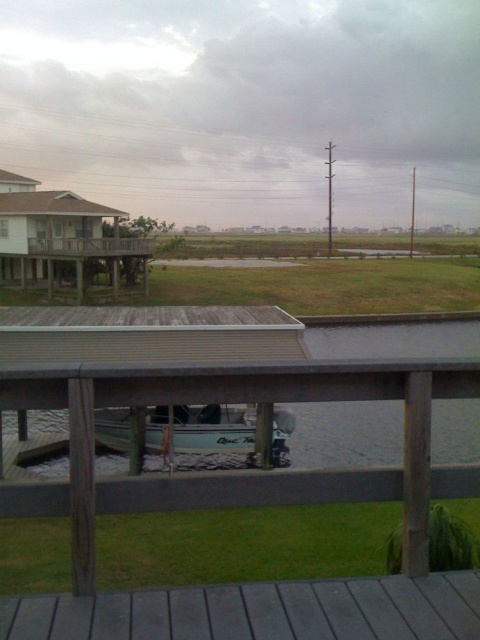
Question: Is dark gray wood deck at lower center below light blue fiberglass boat at center?

Choices:
 (A) no
 (B) yes

Answer: (A)

Question: Which object is farther from the camera taking this photo?

Choices:
 (A) dark gray wood deck at lower center
 (B) light blue fiberglass boat at center

Answer: (B)

Question: Does dark gray wood deck at lower center have a smaller size compared to light blue fiberglass boat at center?

Choices:
 (A) yes
 (B) no

Answer: (A)

Question: Does dark gray wood deck at lower center come in front of light blue fiberglass boat at center?

Choices:
 (A) yes
 (B) no

Answer: (A)